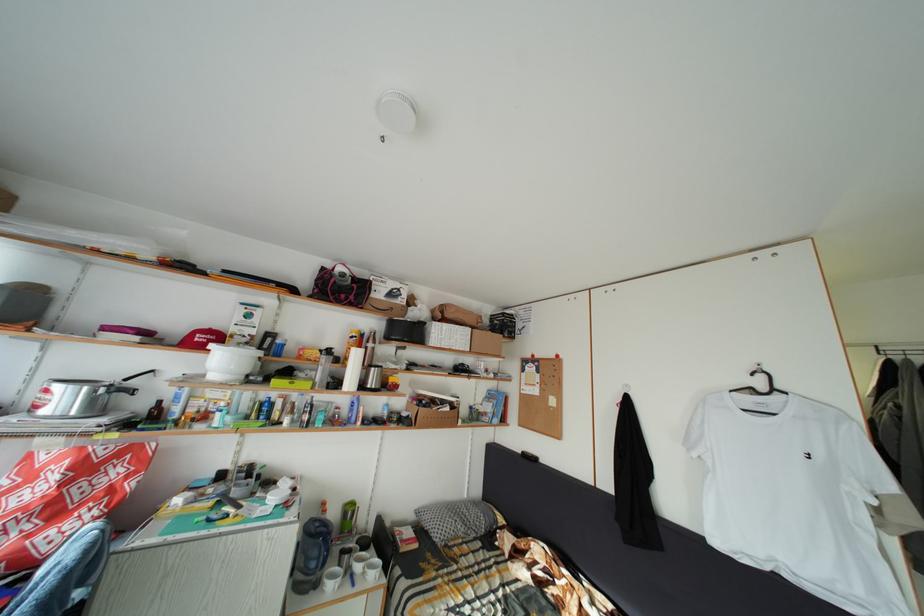
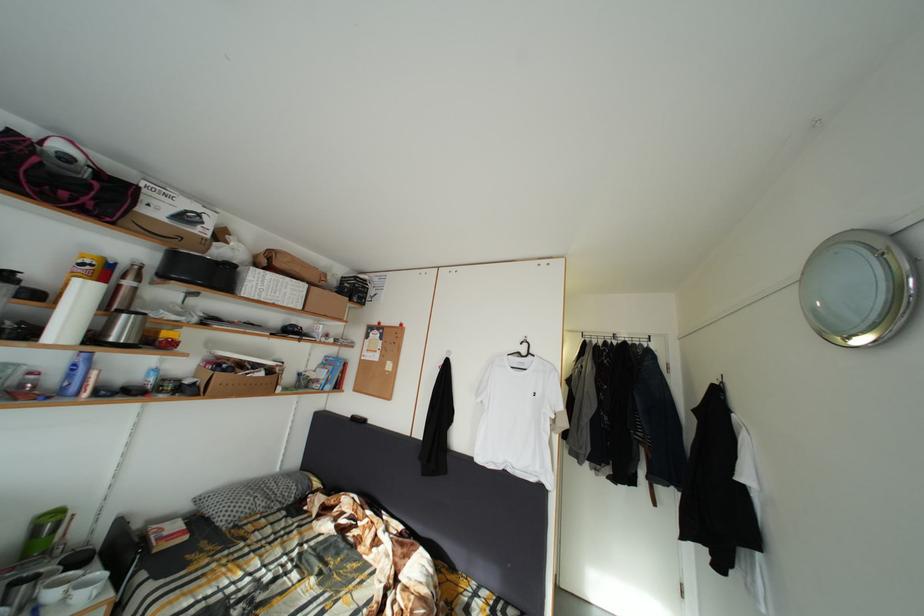
In the second image, find the point that corresponds to point (360, 344) in the first image.

(91, 270)